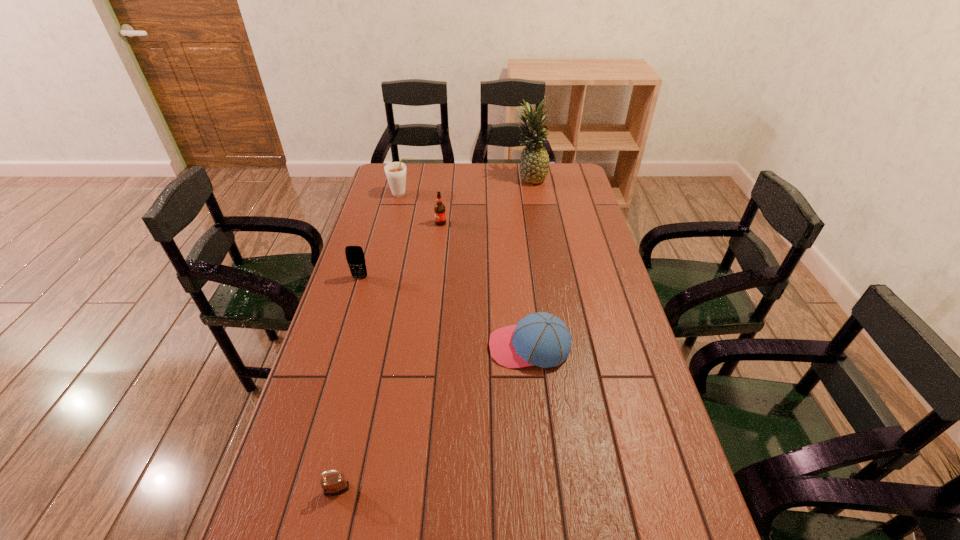
Identify which object is located as the second nearest to the padlock. Please provide its 2D coordinates. Your answer should be formatted as a tuple, i.e. [(x, y)], where the tuple contains the x and y coordinates of a point satisfying the conditions above.

[(355, 257)]

Where is `the fifth closest object to the nearest object`? the fifth closest object to the nearest object is located at coordinates (534, 163).

The width and height of the screenshot is (960, 540). What are the coordinates of `vacant area in the image that satisfies the following two spatial constraints: 1. on the drink side of the fifth shortest object; 2. on the back side of the shortest object` in the screenshot? It's located at (329, 489).

What are the coordinates of `vacant space that satisfies the following two spatial constraints: 1. on the drink side of the fifth nearest object; 2. on the screen of the third nearest object` in the screenshot? It's located at (381, 278).

Locate an element on the screen. The image size is (960, 540). blank space that satisfies the following two spatial constraints: 1. on the drink side of the shorter root beer; 2. on the right side of the farther root beer is located at coordinates (395, 223).

At what (x,y) coordinates should I click in order to perform the action: click on free location that satisfies the following two spatial constraints: 1. on the screen of the padlock; 2. on the right side of the cellular telephone. Please return your answer as a coordinate pair (x, y). This screenshot has height=540, width=960. Looking at the image, I should click on (296, 489).